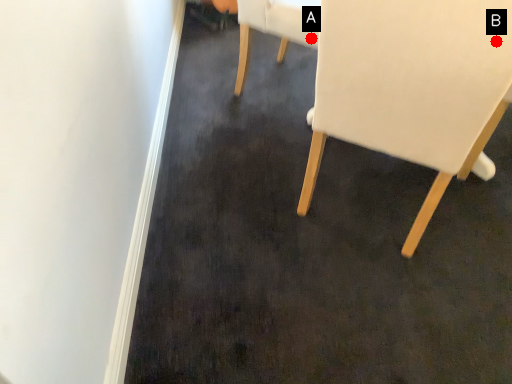
Question: Two points are circled on the image, labeled by A and B beside each circle. Which point is further to the camera?

Choices:
 (A) A is further
 (B) B is further

Answer: (A)